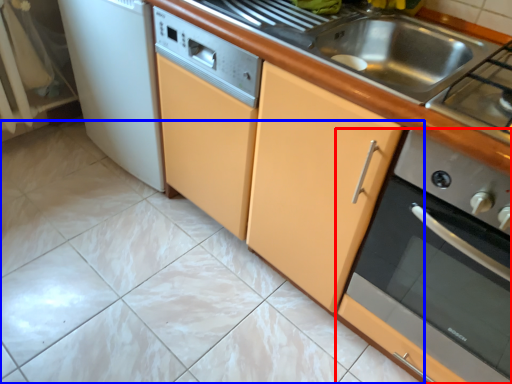
Question: Which of the following is the farthest to the observer, home appliance (highlighted by a red box) or ceramic tile (highlighted by a blue box)?

Choices:
 (A) home appliance
 (B) ceramic tile

Answer: (B)